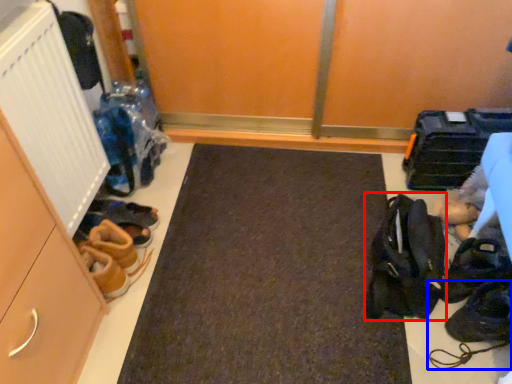
Question: Which point is further to the camera, accessory (highlighted by a red box) or footwear (highlighted by a blue box)?

Choices:
 (A) accessory
 (B) footwear

Answer: (B)